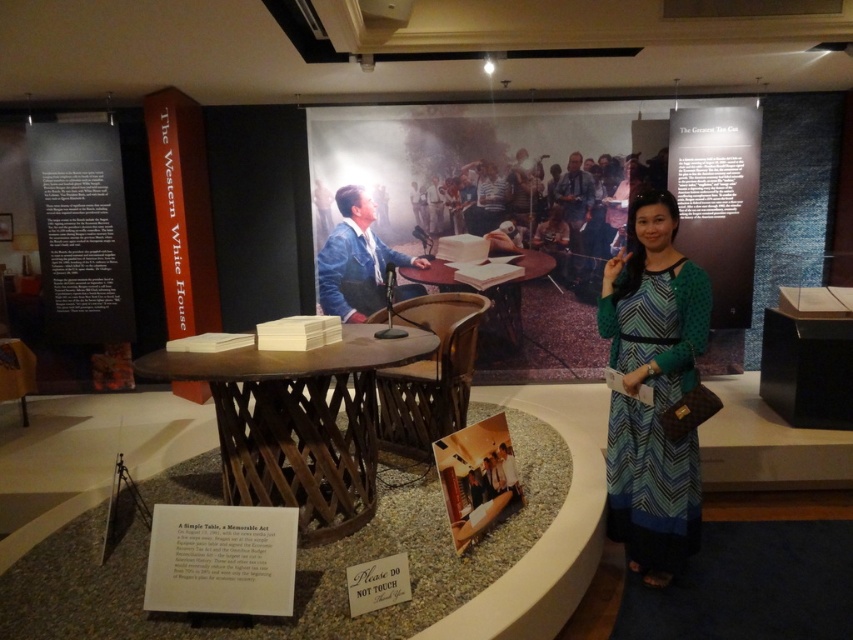
Question: Is denim jacket at center bigger than matte blue shirt at center?

Choices:
 (A) yes
 (B) no

Answer: (A)

Question: Does denim jacket at center appear under light brown wood table at center?

Choices:
 (A) no
 (B) yes

Answer: (B)

Question: Which point is farther to the camera?

Choices:
 (A) (560, 184)
 (B) (660, 410)
 (C) (335, 195)
 (D) (489, 333)

Answer: (D)

Question: Which of these objects is positioned farthest from the green zigzag dress at center?

Choices:
 (A) light brown wood table at center
 (B) denim jacket at center
 (C) wooden round table at center
 (D) wooden table at center

Answer: (B)

Question: In this image, where is denim jacket at center located relative to wooden table at center?

Choices:
 (A) left
 (B) right

Answer: (A)

Question: Which of the following is the farthest from the observer?

Choices:
 (A) tap(350, 512)
 (B) tap(694, 474)
 (C) tap(346, 243)
 (D) tap(575, 268)

Answer: (D)